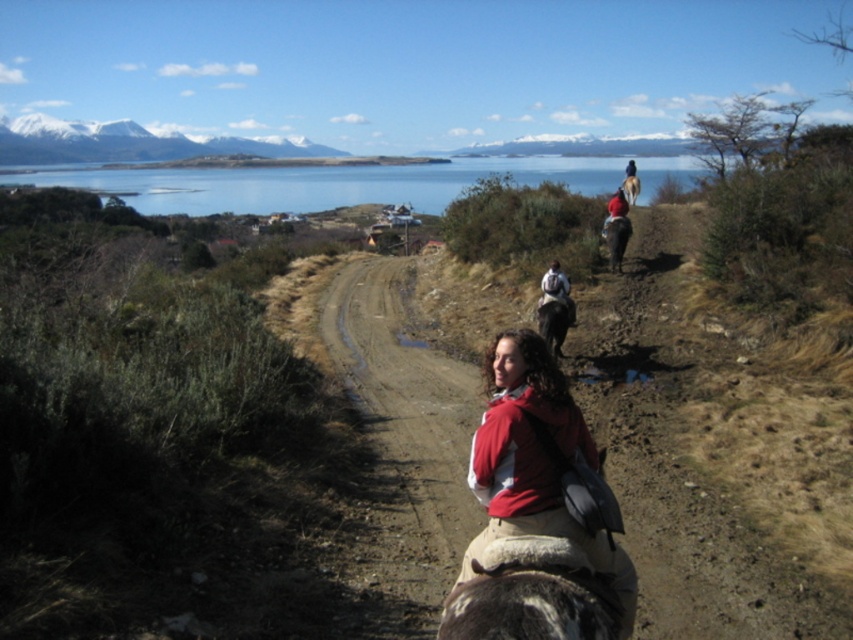
Question: Based on their relative distances, which object is nearer to the brown glossy horse at center?

Choices:
 (A) blue water at upper center
 (B) dark blue jacket at upper center
 (C) red fabric jacket at center
 (D) dark brown leather horse at center

Answer: (C)

Question: Which of the following is the farthest from the observer?

Choices:
 (A) (532, 532)
 (B) (546, 337)
 (C) (622, 193)

Answer: (C)

Question: From the image, what is the correct spatial relationship of blue water at upper center in relation to red fabric jacket at center?

Choices:
 (A) below
 (B) above

Answer: (B)

Question: Does matte black backpack at center appear on the right side of red fabric jacket at center?

Choices:
 (A) no
 (B) yes

Answer: (A)

Question: Which point appears closest to the camera in this image?

Choices:
 (A) (614, 237)
 (B) (627, 170)
 (C) (610, 212)

Answer: (A)

Question: Where is red fleece jacket at center located in relation to matte black backpack at center in the image?

Choices:
 (A) below
 (B) above

Answer: (A)